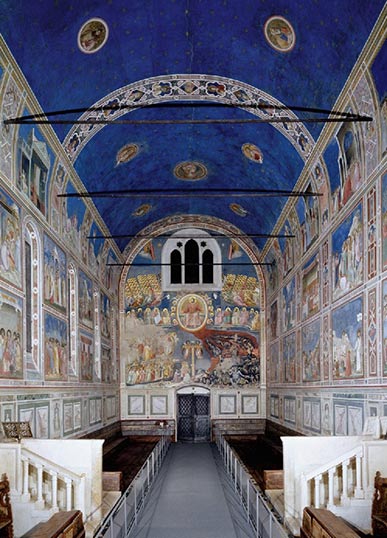
Identify the location of ceiling. Image resolution: width=387 pixels, height=538 pixels. (191, 38).